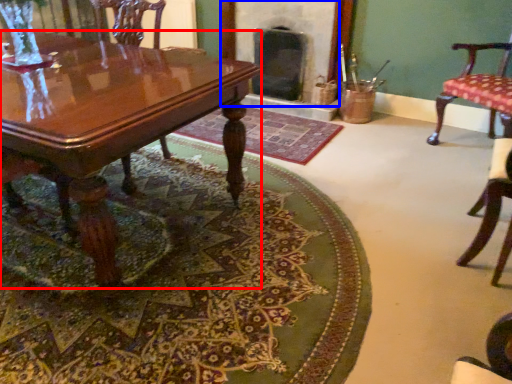
Question: Which of the following is the closest to the observer, coffee table (highlighted by a red box) or fireplace (highlighted by a blue box)?

Choices:
 (A) coffee table
 (B) fireplace

Answer: (A)